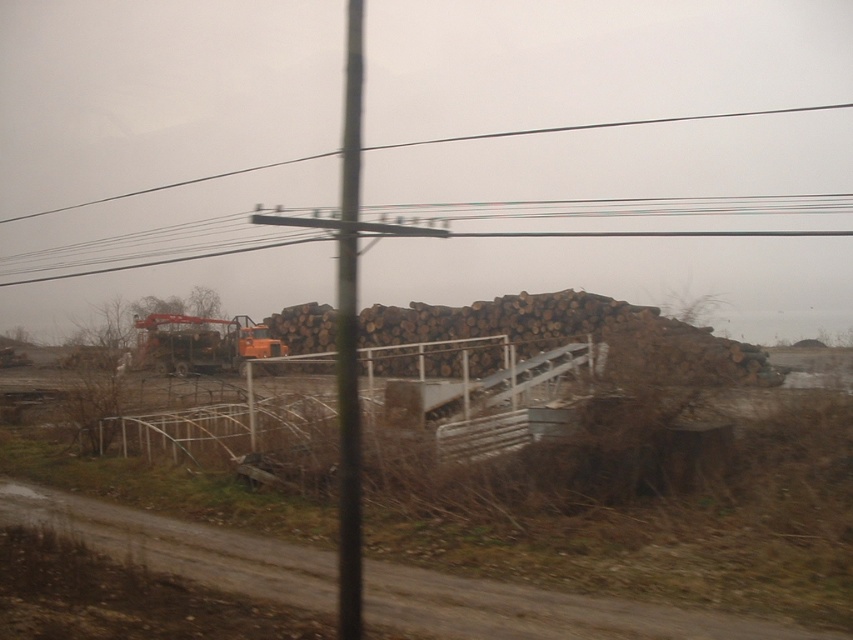
You are a safety inspector checking the outdoor logging area. You notice the metallic wire at upper center and the orange metallic excavator at center. Which object is bigger in size?

The metallic wire at upper center is larger in size than the orange metallic excavator at center.

From the picture: You are a safety inspector at the logging site. You notice the metallic pole at center and the orange metallic excavator at center. Which object is blocking the other from being fully visible?

The metallic pole at center is positioned over orange metallic excavator at center, so the metallic pole at center is blocking the excavator from being fully visible.

You are a safety inspector checking the equipment in this logging area. You notice the metallic pole at center and the metallic wire at upper center. Which object is narrower in width?

The metallic pole at center has a lesser width compared to the metallic wire at upper center, so the metallic pole at center is narrower.